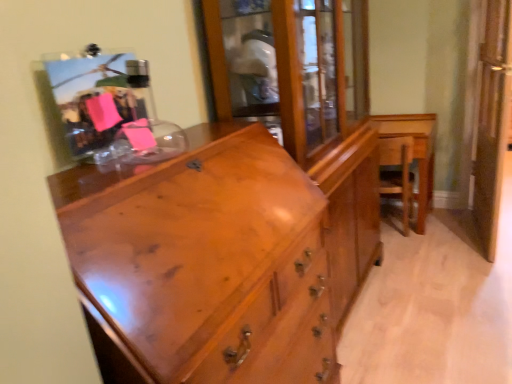
What do you see at coordinates (222, 257) in the screenshot?
I see `shiny brown wood chest of drawers at center` at bounding box center [222, 257].

Describe the element at coordinates (492, 121) in the screenshot. I see `clear glass screen door at right` at that location.

The image size is (512, 384). Find the location of `shiny brown wood chest of drawers at center`. shiny brown wood chest of drawers at center is located at coordinates (222, 257).

From a real-world perspective, who is located higher, shiny brown wood chest of drawers at center or wooden table at right?

shiny brown wood chest of drawers at center is physically above.

Is shiny brown wood chest of drawers at center to the left or to the right of wooden table at right in the image?

shiny brown wood chest of drawers at center is positioned on wooden table at right's left side.

Looking at their sizes, would you say shiny brown wood chest of drawers at center is wider or thinner than wooden table at right?

Clearly, shiny brown wood chest of drawers at center has less width compared to wooden table at right.

How many degrees apart are the facing directions of shiny brown wood chest of drawers at center and clear glass screen door at right?

The angular difference between shiny brown wood chest of drawers at center and clear glass screen door at right is 8.67 degrees.

Which is less distant, (211,143) or (493,206)?

Clearly, point (211,143) is closer to the camera than point (493,206).

Can we say shiny brown wood chest of drawers at center lies outside clear glass screen door at right?

That's correct, shiny brown wood chest of drawers at center is outside of clear glass screen door at right.

Is there a large distance between shiny brown wood chest of drawers at center and clear glass screen door at right?

Yes, shiny brown wood chest of drawers at center is far from clear glass screen door at right.

In the image, is wooden table at right positioned in front of or behind shiny brown wood chest of drawers at center?

wooden table at right is positioned farther from the viewer than shiny brown wood chest of drawers at center.

Is wooden table at right positioned far away from shiny brown wood chest of drawers at center?

Yes, wooden table at right is far from shiny brown wood chest of drawers at center.

Looking at this image, is shiny brown wood chest of drawers at center inside wooden table at right?

Definitely not — shiny brown wood chest of drawers at center is not inside wooden table at right.

From a real-world perspective, does wooden table at right sit lower than shiny brown wood chest of drawers at center?

Indeed, from a real-world perspective, wooden table at right is positioned beneath shiny brown wood chest of drawers at center.

From the image's perspective, is wooden table at right located above clear glass screen door at right?

No.

Considering the points (426, 198) and (490, 87), which point is behind, point (426, 198) or point (490, 87)?

The point (426, 198) is farther.

Could clear glass screen door at right be considered to be inside wooden table at right?

No, clear glass screen door at right is not surrounded by wooden table at right.

How far apart are wooden table at right and clear glass screen door at right?

wooden table at right is 42.64 centimeters from clear glass screen door at right.

Considering their positions, is clear glass screen door at right located in front of or behind shiny brown wood chest of drawers at center?

clear glass screen door at right is positioned farther from the viewer than shiny brown wood chest of drawers at center.

From a real-world perspective, which is physically above, clear glass screen door at right or shiny brown wood chest of drawers at center?

clear glass screen door at right is physically above.

Find the location of a particular element. The width and height of the screenshot is (512, 384). the chest of drawers located below the clear glass screen door at right (from the image's perspective) is located at coordinates (222, 257).

Which of these two, clear glass screen door at right or shiny brown wood chest of drawers at center, stands shorter?

Standing shorter between the two is shiny brown wood chest of drawers at center.

Between clear glass screen door at right and wooden armchair at right, which one has larger width?

Wider between the two is wooden armchair at right.

Does clear glass screen door at right turn towards wooden armchair at right?

No, clear glass screen door at right does not turn towards wooden armchair at right.

Is clear glass screen door at right taller or shorter than wooden armchair at right?

Considering their sizes, clear glass screen door at right has more height than wooden armchair at right.

Does point (511, 69) lie behind point (383, 175)?

That is False.

Consider the image. In the image, is wooden armchair at right positioned in front of or behind wooden table at right?

wooden armchair at right is behind wooden table at right.

Which is more to the left, wooden armchair at right or wooden table at right?

From the viewer's perspective, wooden armchair at right appears more on the left side.

Considering the relative sizes of wooden armchair at right and wooden table at right in the image provided, is wooden armchair at right smaller than wooden table at right?

Yes, wooden armchair at right is smaller than wooden table at right.

From the image's perspective, which is below, wooden armchair at right or wooden table at right?

wooden armchair at right, from the image's perspective.

Where is `the chest of drawers that appears in front of the wooden table at right`? the chest of drawers that appears in front of the wooden table at right is located at coordinates (222, 257).

Identify the location of screen door that is above the shiny brown wood chest of drawers at center (from a real-world perspective). The width and height of the screenshot is (512, 384). (492, 121).

Consider the image. When comparing their distances from wooden table at right, does clear glass screen door at right or shiny brown wood chest of drawers at center seem further?

shiny brown wood chest of drawers at center is further to wooden table at right.

Looking at the image, which one is located further to clear glass screen door at right, wooden armchair at right or shiny brown wood chest of drawers at center?

shiny brown wood chest of drawers at center lies further to clear glass screen door at right than the other object.

When comparing their distances from shiny brown wood chest of drawers at center, does wooden table at right or wooden armchair at right seem closer?

wooden armchair at right is closer to shiny brown wood chest of drawers at center.

Which object lies nearer to the anchor point wooden table at right, shiny brown wood chest of drawers at center or wooden armchair at right?

wooden armchair at right is positioned closer to the anchor wooden table at right.

Estimate the real-world distances between objects in this image. Which object is further from clear glass screen door at right, wooden armchair at right or wooden table at right?

wooden armchair at right is further to clear glass screen door at right.

Estimate the real-world distances between objects in this image. Which object is further from clear glass screen door at right, wooden table at right or wooden armchair at right?

wooden armchair at right lies further to clear glass screen door at right than the other object.

Which object lies further to the anchor point wooden armchair at right, wooden table at right or clear glass screen door at right?

clear glass screen door at right is positioned further to the anchor wooden armchair at right.

When comparing their distances from wooden table at right, does shiny brown wood chest of drawers at center or clear glass screen door at right seem further?

Among the two, shiny brown wood chest of drawers at center is located further to wooden table at right.

Identify the location of table between shiny brown wood chest of drawers at center and wooden armchair at right along the z-axis. The height and width of the screenshot is (384, 512). (415, 153).

The image size is (512, 384). I want to click on screen door between shiny brown wood chest of drawers at center and wooden armchair at right from front to back, so click(492, 121).

Image resolution: width=512 pixels, height=384 pixels. I want to click on table between clear glass screen door at right and wooden armchair at right in the front-back direction, so click(x=415, y=153).

Image resolution: width=512 pixels, height=384 pixels. What are the coordinates of `screen door between shiny brown wood chest of drawers at center and wooden table at right in the front-back direction` in the screenshot? It's located at coord(492,121).